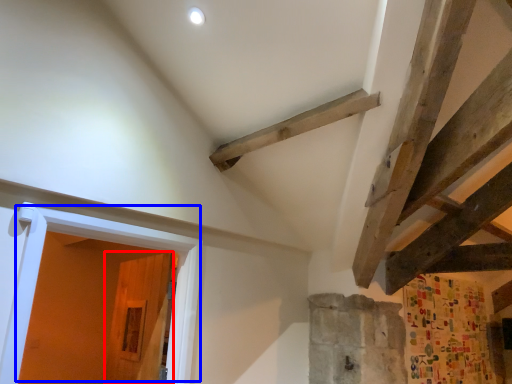
Question: Which of the following is the closest to the observer, door (highlighted by a red box) or door (highlighted by a blue box)?

Choices:
 (A) door
 (B) door

Answer: (B)